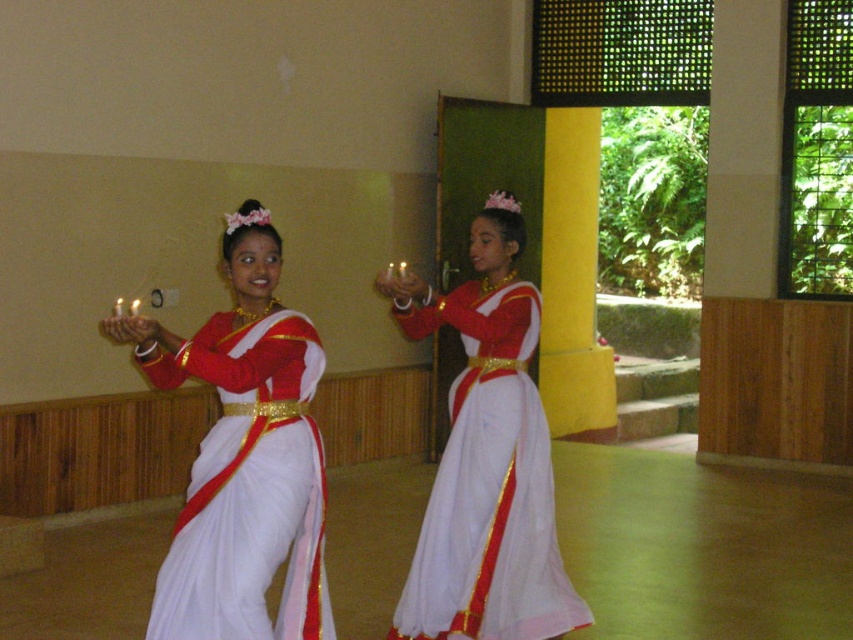
Question: Does white silk saree at center appear on the right side of white satin sari at center?

Choices:
 (A) no
 (B) yes

Answer: (A)

Question: Does white silk saree at center appear under white satin sari at center?

Choices:
 (A) yes
 (B) no

Answer: (B)

Question: Does white silk saree at center come behind white satin sari at center?

Choices:
 (A) yes
 (B) no

Answer: (B)

Question: Which point is closer to the camera?

Choices:
 (A) (306, 378)
 (B) (485, 550)

Answer: (A)